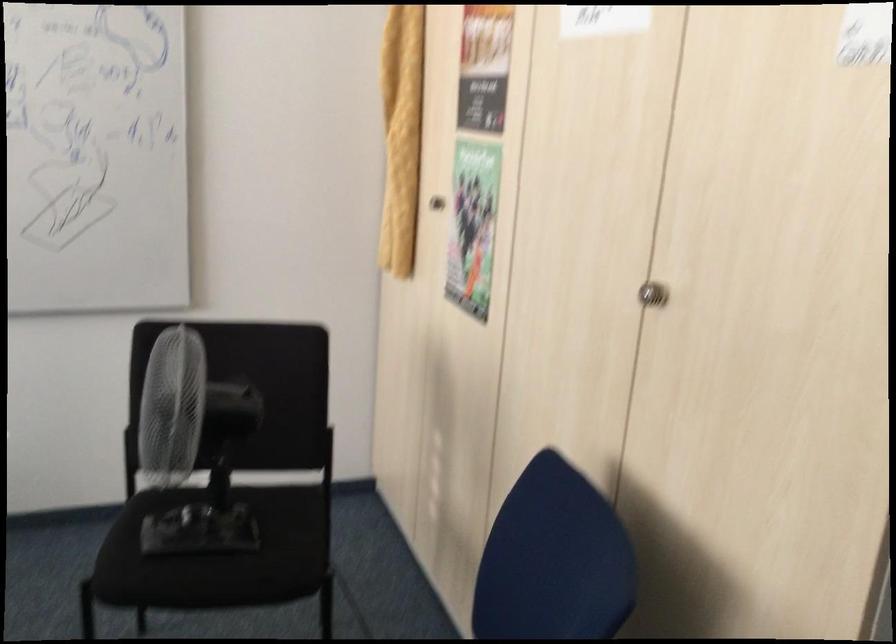
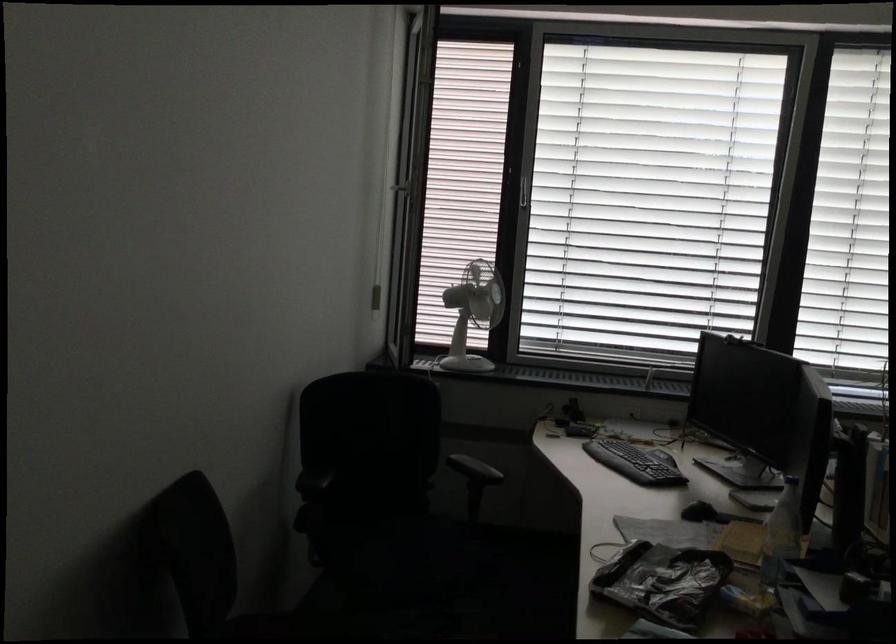
Question: The camera is either moving clockwise (left) or counter-clockwise (right) around the object. The first image is from the beginning of the video and the second image is from the end. Is the camera moving left or right when shooting the video?

Choices:
 (A) Left
 (B) Right

Answer: (B)